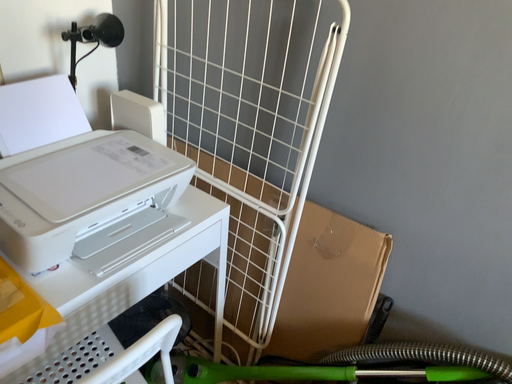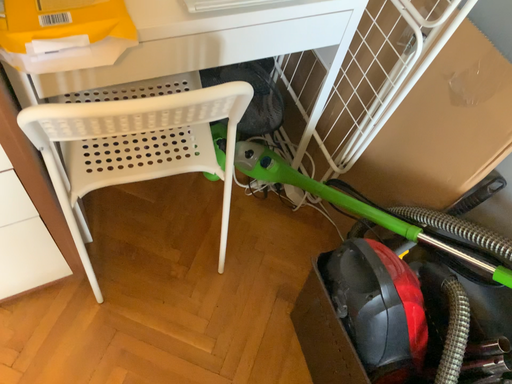
Question: How did the camera likely rotate when shooting the video?

Choices:
 (A) rotated downward
 (B) rotated upward

Answer: (A)